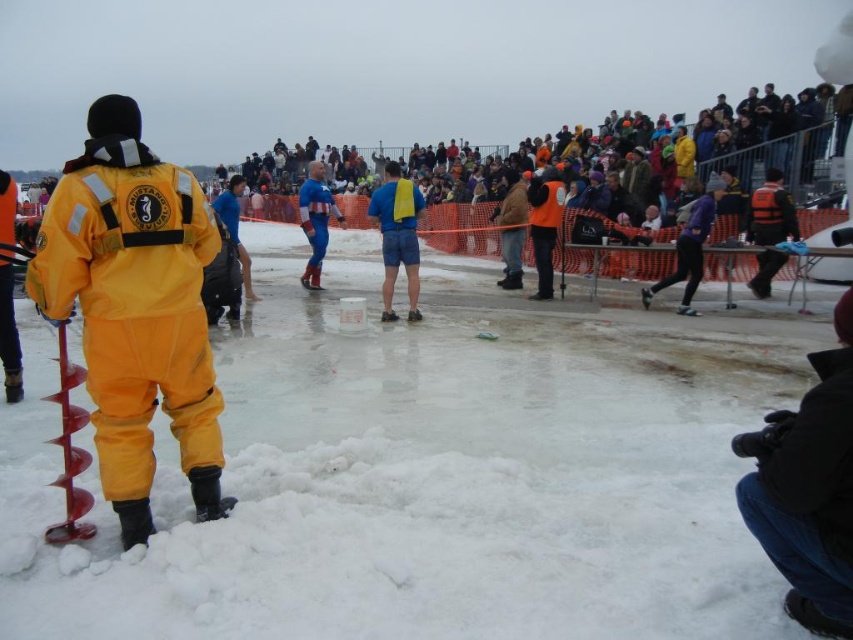
Question: Can you confirm if white fluffy snow at lower left is wider than blue spandex suit at center?

Choices:
 (A) yes
 (B) no

Answer: (A)

Question: Which point is closer to the camera?

Choices:
 (A) purple fabric pants at center
 (B) white fluffy snow at lower left
 (C) orange matte jacket at center
 (D) brown woolen jacket at center

Answer: (B)

Question: Is blue fabric shorts at center smaller than blue spandex suit at center?

Choices:
 (A) no
 (B) yes

Answer: (A)

Question: Estimate the real-world distances between objects in this image. Which object is closer to the white fluffy snow at lower left?

Choices:
 (A) black fleece jacket at lower right
 (B) blue spandex suit at center

Answer: (A)

Question: Is blue spandex suit at center smaller than brown woolen jacket at center?

Choices:
 (A) yes
 (B) no

Answer: (B)

Question: Which point is farther to the camera?

Choices:
 (A) (236, 177)
 (B) (838, 440)

Answer: (A)